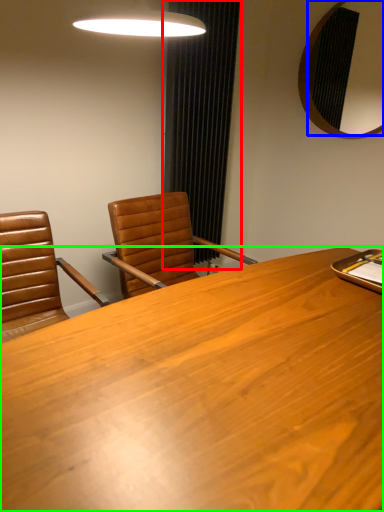
Question: Which is farther away from curtain (highlighted by a red box)? mirror (highlighted by a blue box) or desk (highlighted by a green box)?

Choices:
 (A) mirror
 (B) desk

Answer: (B)